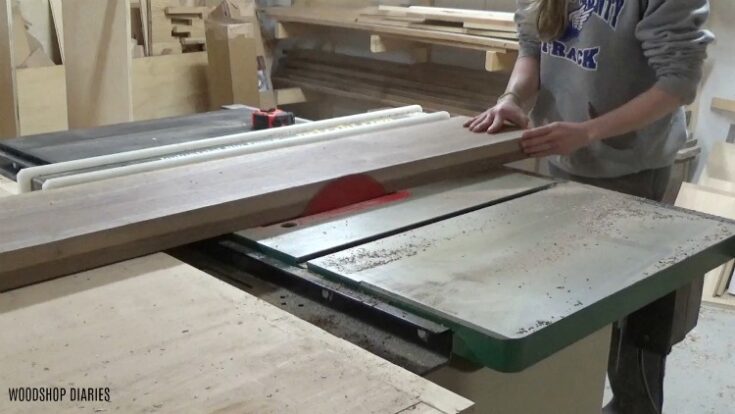
In order to click on table in this screenshot , I will do `click(220, 374)`.